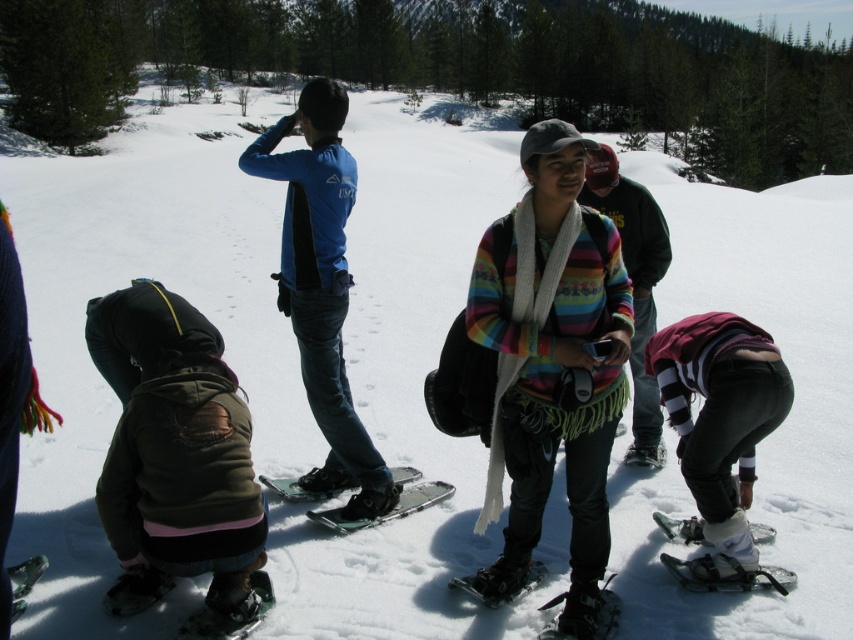
Looking at this image, which of these two, black rubber snowshoe at lower center or white plastic snowshoe at lower right, stands taller?

black rubber snowshoe at lower center is taller.

Is point (567, 621) positioned after point (770, 580)?

That is False.

Identify the location of black rubber snowshoe at lower center. This screenshot has height=640, width=853. [583, 612].

Can you confirm if multicolored knitted sweater at center is taller than striped sweater at center?

Indeed, multicolored knitted sweater at center has a greater height compared to striped sweater at center.

Between multicolored knitted sweater at center and striped sweater at center, which one has more height?

With more height is multicolored knitted sweater at center.

You are a GUI agent. You are given a task and a screenshot of the screen. Output one action in this format:
    pyautogui.click(x=<x>, y=<y>)
    Task: Click on the multicolored knitted sweater at center
    Image resolution: width=853 pixels, height=640 pixels.
    Given the screenshot: What is the action you would take?
    pyautogui.click(x=550, y=368)

Between green metallic ski at center and black rubber snowshoe at lower center, which one has less height?

black rubber snowshoe at lower center

Between green metallic ski at center and black rubber snowshoe at lower center, which one appears on the left side from the viewer's perspective?

green metallic ski at center is more to the left.

Is point (347, 532) in front of point (616, 616)?

That is False.

This screenshot has width=853, height=640. Identify the location of green metallic ski at center. click(x=395, y=504).